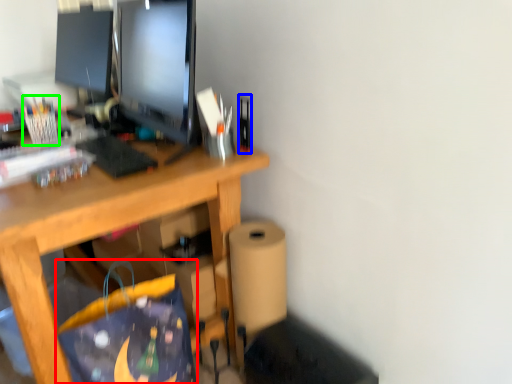
Question: Estimate the real-world distances between objects in this image. Which object is closer to shopping bag (highlighted by a red box), stationery (highlighted by a blue box) or stationery (highlighted by a green box)?

Choices:
 (A) stationery
 (B) stationery

Answer: (A)